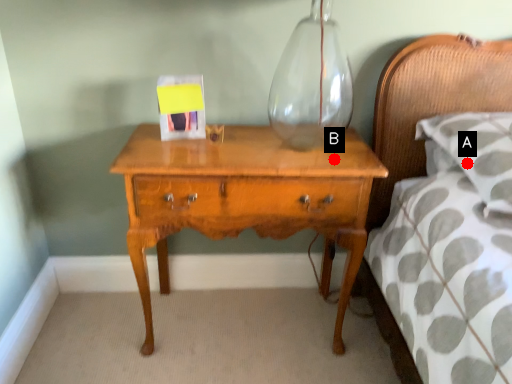
Question: Two points are circled on the image, labeled by A and B beside each circle. Which point is closer to the camera taking this photo?

Choices:
 (A) A is closer
 (B) B is closer

Answer: (B)